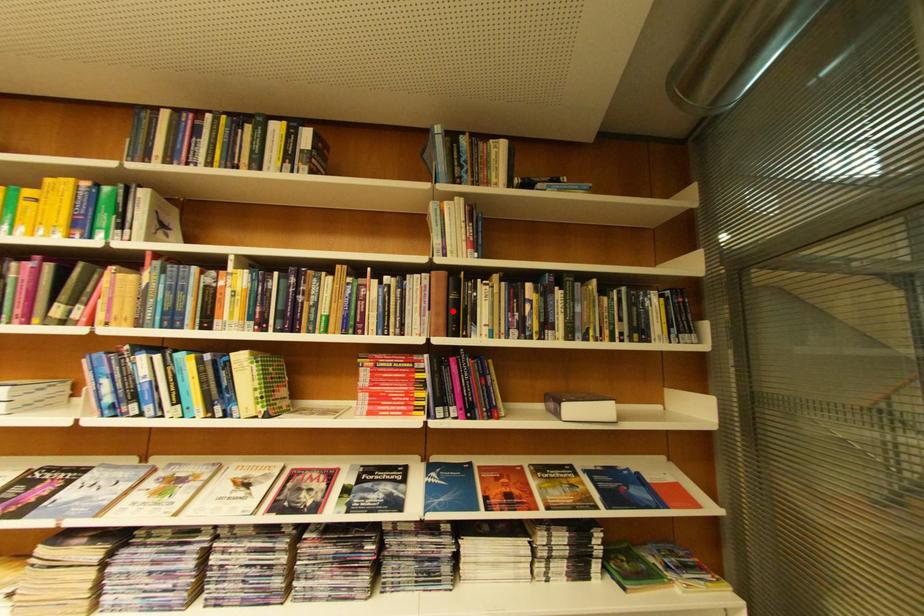
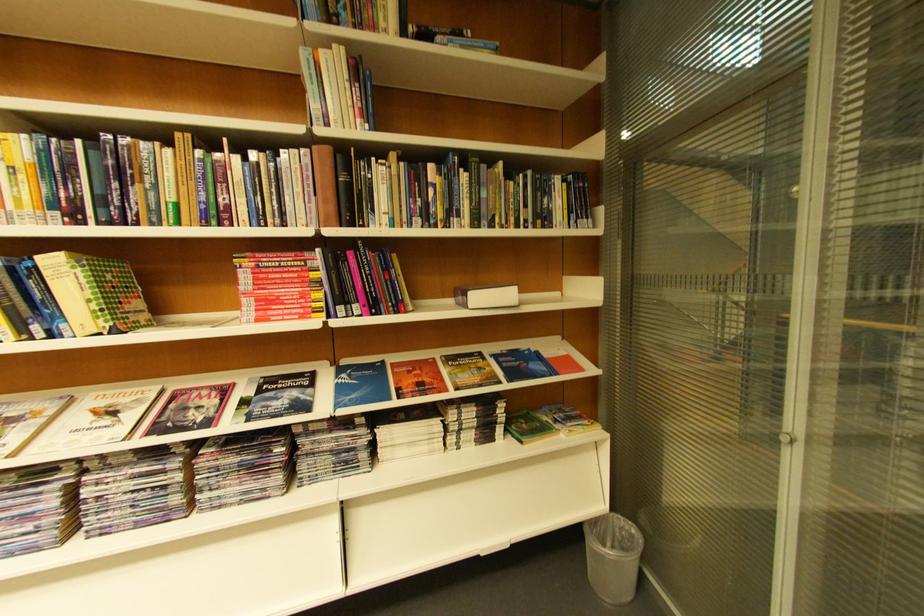
Find the pixel in the second image that matches the highlighted location in the first image.

(342, 196)